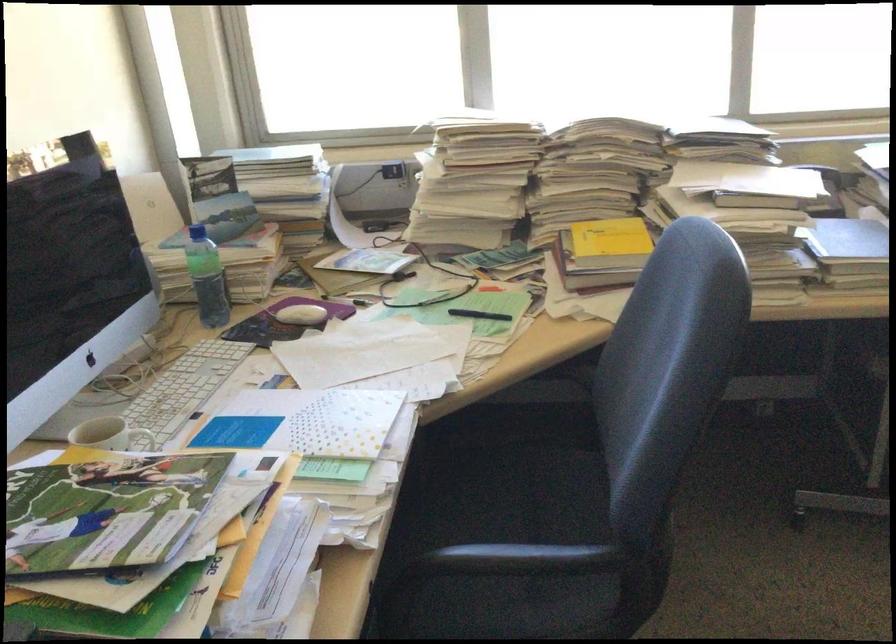
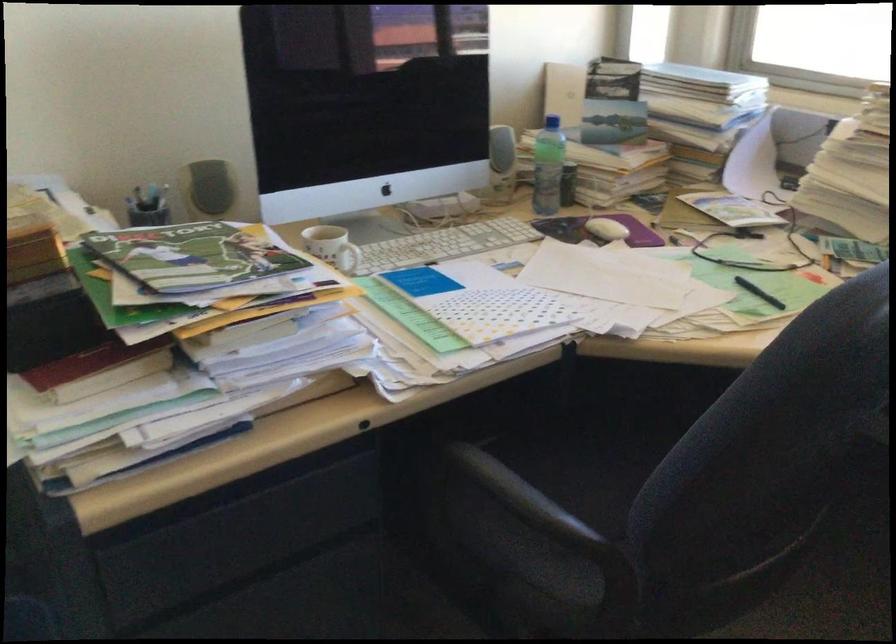
Question: The images are taken continuously from a first-person perspective. In which direction is your viewpoint rotating?

Choices:
 (A) Left
 (B) Right
 (C) Up
 (D) Down

Answer: (A)